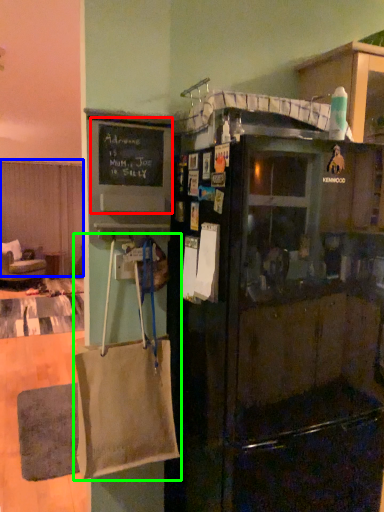
Question: Which object is the closest to the bulletin board (highlighted by a red box)? Choose among these: curtain (highlighted by a blue box) or grocery bag (highlighted by a green box).

Choices:
 (A) curtain
 (B) grocery bag

Answer: (B)